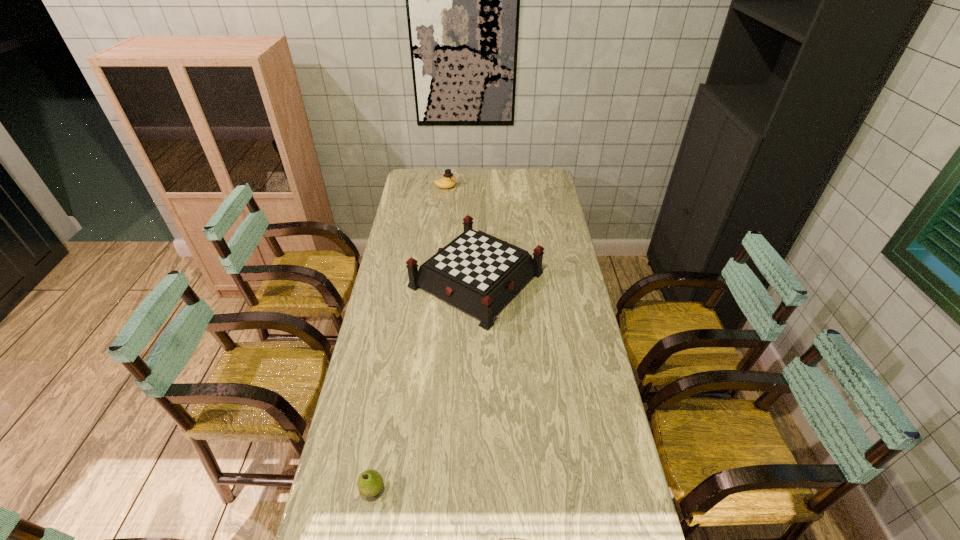
Where is `free space that is in between the checkerboard and the nearest object`? The width and height of the screenshot is (960, 540). free space that is in between the checkerboard and the nearest object is located at coordinates (424, 384).

Locate which object is the second closest to the duck. Please provide its 2D coordinates. Your answer should be formatted as a tuple, i.e. [(x, y)], where the tuple contains the x and y coordinates of a point satisfying the conditions above.

[(370, 482)]

Where is `object that is the closest to the farthest object`? Image resolution: width=960 pixels, height=540 pixels. object that is the closest to the farthest object is located at coordinates (478, 273).

Where is `free space that satisfies the following two spatial constraints: 1. on the front-facing side of the tallest object; 2. on the left side of the farthest object`? free space that satisfies the following two spatial constraints: 1. on the front-facing side of the tallest object; 2. on the left side of the farthest object is located at coordinates (435, 279).

At what (x,y) coordinates should I click in order to perform the action: click on free space in the image that satisfies the following two spatial constraints: 1. on the back side of the checkerboard; 2. on the right side of the pear. Please return your answer as a coordinate pair (x, y). This screenshot has height=540, width=960. Looking at the image, I should click on pyautogui.click(x=409, y=279).

Where is `vacant region that satisfies the following two spatial constraints: 1. on the back side of the checkerboard; 2. on the right side of the nearest object`? The image size is (960, 540). vacant region that satisfies the following two spatial constraints: 1. on the back side of the checkerboard; 2. on the right side of the nearest object is located at coordinates (409, 279).